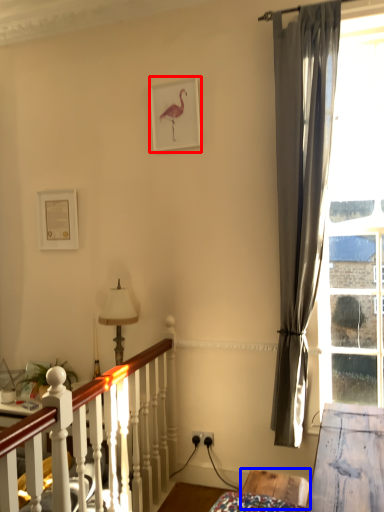
Question: Which point is further to the camera, picture frame (highlighted by a red box) or furniture (highlighted by a blue box)?

Choices:
 (A) picture frame
 (B) furniture

Answer: (A)